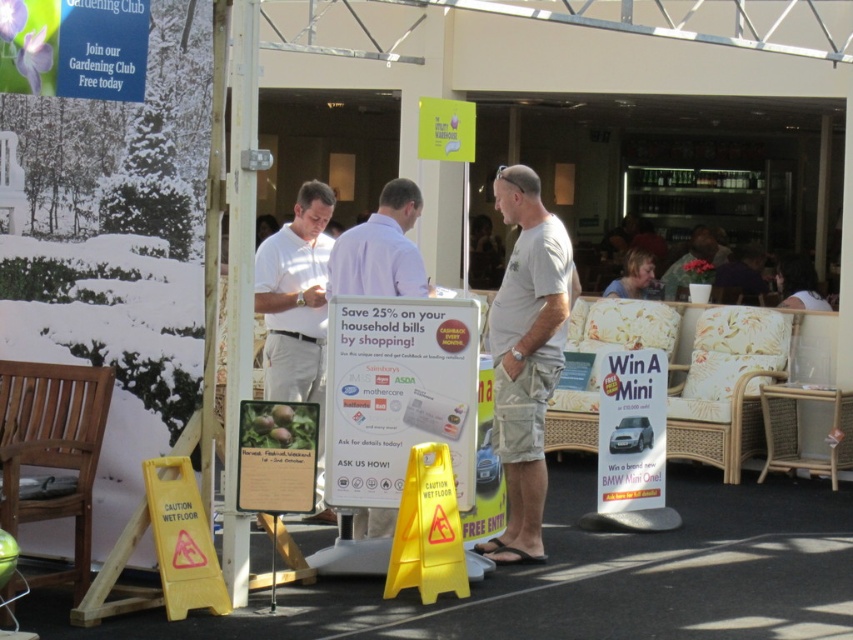
Does point (350, 426) come in front of point (631, 499)?

Yes, it is.

Based on the photo, is white paper sign at center wider than metallic silver car at lower right?

Yes, white paper sign at center is wider than metallic silver car at lower right.

Where is `white paper sign at center`? Image resolution: width=853 pixels, height=640 pixels. white paper sign at center is located at coordinates (398, 394).

Identify the location of white paper sign at center. This screenshot has height=640, width=853. pyautogui.click(x=398, y=394).

Is point (532, 333) less distant than point (305, 205)?

That is True.

Based on the photo, between white cotton t-shirt at center and white cotton shirt at center, which one has more height?

With more height is white cotton t-shirt at center.

Measure the distance between white cotton t-shirt at center and camera.

white cotton t-shirt at center and camera are 7.64 meters apart from each other.

At what (x,y) coordinates should I click in order to perform the action: click on white cotton t-shirt at center. Please return your answer as a coordinate pair (x, y). The width and height of the screenshot is (853, 640). Looking at the image, I should click on (526, 355).

Is metallic silver car at lower right shorter than light blue shirt at center?

Incorrect, metallic silver car at lower right's height does not fall short of light blue shirt at center's.

Is metallic silver car at lower right bigger than light blue shirt at center?

No.

The image size is (853, 640). What are the coordinates of `metallic silver car at lower right` in the screenshot? It's located at (631, 432).

Locate an element on the screen. metallic silver car at lower right is located at coordinates (631, 432).